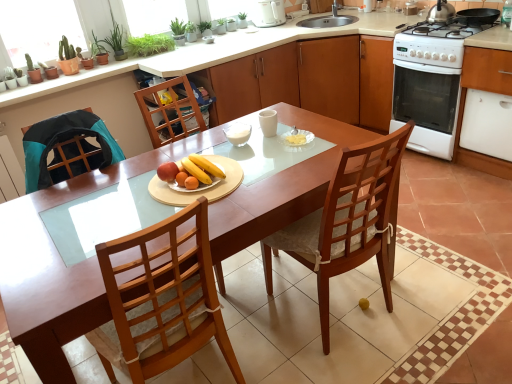
Where is `free spot below green leafy plant at upper left (from a real-world perspective)`? Image resolution: width=512 pixels, height=384 pixels. free spot below green leafy plant at upper left (from a real-world perspective) is located at coordinates (147, 48).